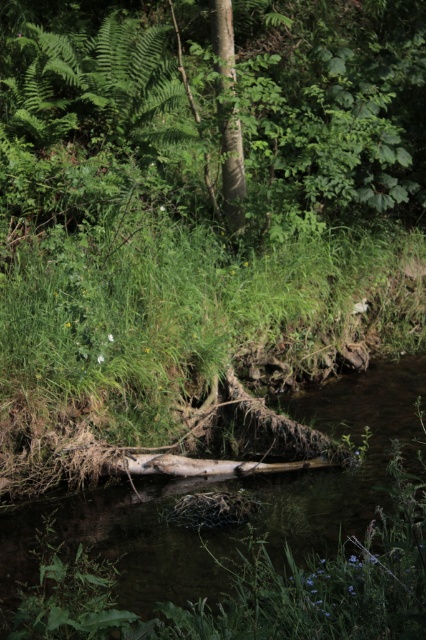
You are a hiker who wants to cross the stream. You see the brown wood log at center and the smooth bark tree trunk at center. Which one is more suitable to step on for crossing?

The smooth bark tree trunk at center is more suitable to step on for crossing because it is larger than the brown wood log at center, providing a more stable surface.

You are a hiker trying to cross the stream. You see the brown wood log at center and the smooth bark tree trunk at center. Which object should you step on first to cross the stream safely?

You should step on the smooth bark tree trunk at center first because the brown wood log at center is positioned to its right side, making the smooth bark tree trunk at center the closer option for crossing the stream safely.

You are standing at the point with coordinates point(230,60) and want to reach the point with coordinates point(58,572). Which direction should you move to get closer to your destination?

You should move forward because point(58,572) is in front of point(230,60).